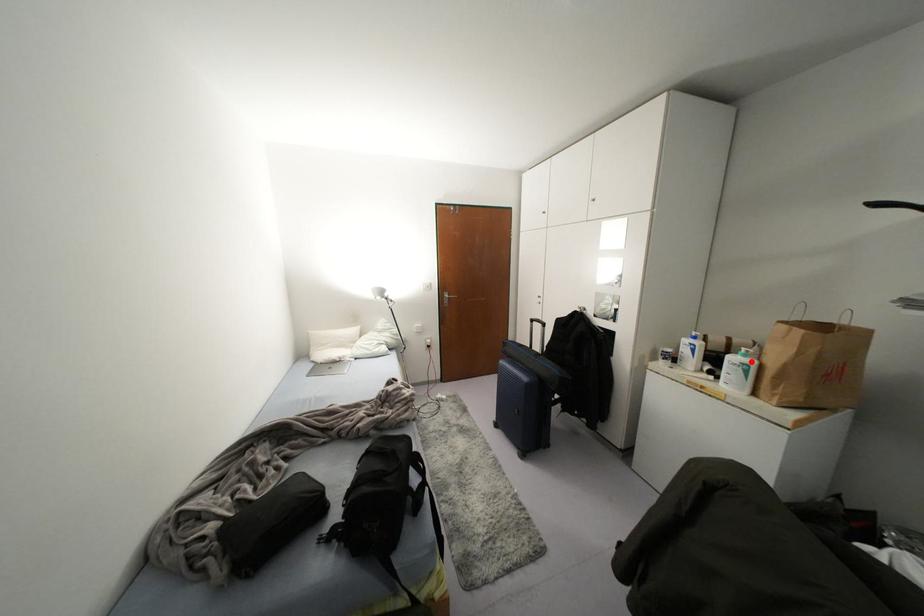
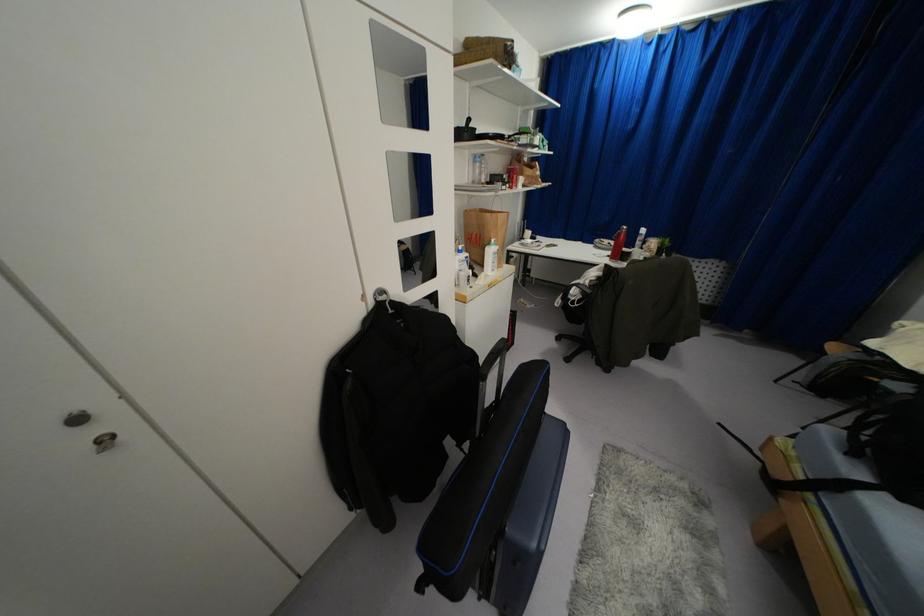
The point at the highlighted location is marked in the first image. Where is the corresponding point in the second image?

(495, 246)